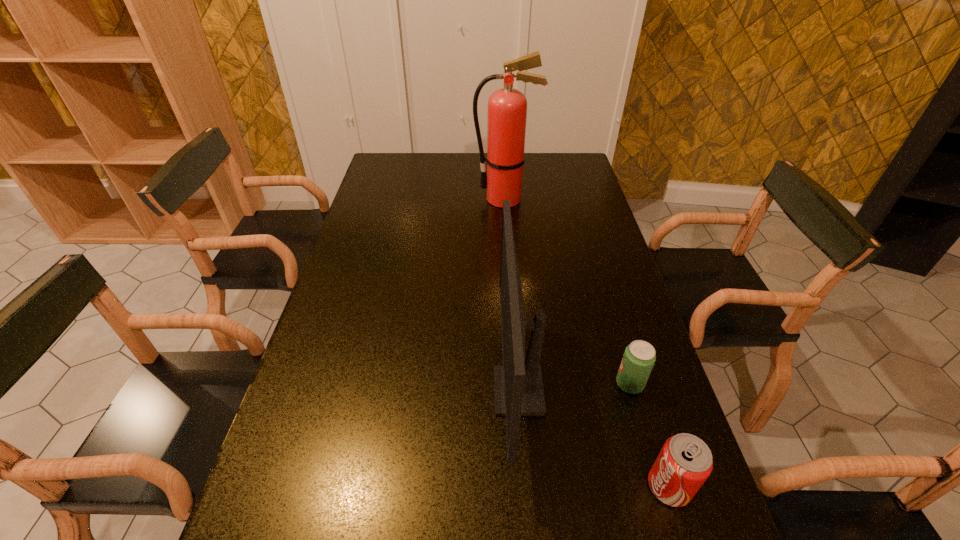
You are a GUI agent. You are given a task and a screenshot of the screen. Output one action in this format:
    pyautogui.click(x=<x>, y=<y>)
    Task: Click on the blank region between the nearer soda and the shortest object
    Image resolution: width=960 pixels, height=540 pixels.
    Given the screenshot: What is the action you would take?
    pyautogui.click(x=650, y=435)

The image size is (960, 540). Find the location of `empty location between the farther soda and the nearer soda`. empty location between the farther soda and the nearer soda is located at coordinates (650, 435).

Locate an element on the screen. The image size is (960, 540). vacant area between the farthest object and the shorter soda is located at coordinates (567, 291).

You are a GUI agent. You are given a task and a screenshot of the screen. Output one action in this format:
    pyautogui.click(x=<x>, y=<y>)
    Task: Click on the vacant space in between the shortest object and the fire extinguisher
    Image resolution: width=960 pixels, height=540 pixels.
    Given the screenshot: What is the action you would take?
    pyautogui.click(x=567, y=291)

You are a GUI agent. You are given a task and a screenshot of the screen. Output one action in this format:
    pyautogui.click(x=<x>, y=<y>)
    Task: Click on the object identified as the third closest to the shortest object
    
    Given the screenshot: What is the action you would take?
    pyautogui.click(x=507, y=108)

Identify which object is the third nearest to the farther soda. Please provide its 2D coordinates. Your answer should be formatted as a tuple, i.e. [(x, y)], where the tuple contains the x and y coordinates of a point satisfying the conditions above.

[(507, 108)]

Select which soda appears as the second closest to the third shortest object. Please provide its 2D coordinates. Your answer should be formatted as a tuple, i.e. [(x, y)], where the tuple contains the x and y coordinates of a point satisfying the conditions above.

[(684, 463)]

Where is `vacant space that satisfies the following two spatial constraints: 1. on the front-facing side of the computer monitor; 2. on the right side of the nearer soda`? vacant space that satisfies the following two spatial constraints: 1. on the front-facing side of the computer monitor; 2. on the right side of the nearer soda is located at coordinates (526, 486).

The width and height of the screenshot is (960, 540). What are the coordinates of `vacant space that satisfies the following two spatial constraints: 1. on the hose direction of the tallest object; 2. on the back side of the nearer soda` in the screenshot? It's located at (528, 486).

Find the location of a particular element. free space in the image that satisfies the following two spatial constraints: 1. on the back side of the farther soda; 2. on the hose direction of the farthest object is located at coordinates (575, 199).